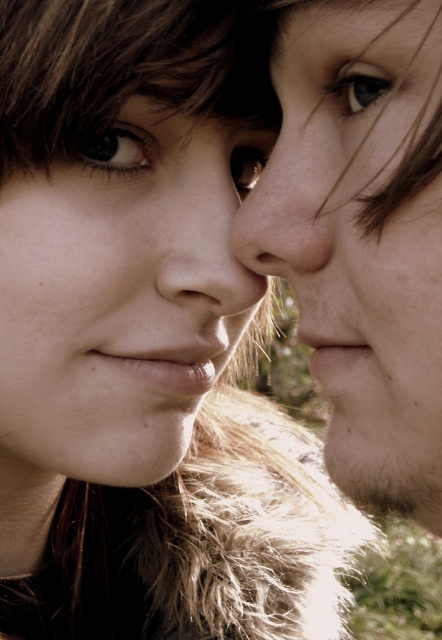
You are a photographer adjusting the focus on a camera. You notice two points in the frame at coordinates point [137,141] and point [358,93]. Which point should you focus on to ensure the subject in the foreground is sharp?

Point [358,93] should be focused on because it is in the foreground, while point [137,141] is behind it.

Based on the scene description, which object is positioned higher in the image between the smooth skin nose at center and the brown matte eye at center?

The smooth skin nose at center is positioned higher than the brown matte eye at center in the image.

Based on the scene description, where is the smooth skin face at center positioned in relation to the other person?

The smooth skin face at center is located at point (118, 300), which places it slightly to the left and lower than the other person.